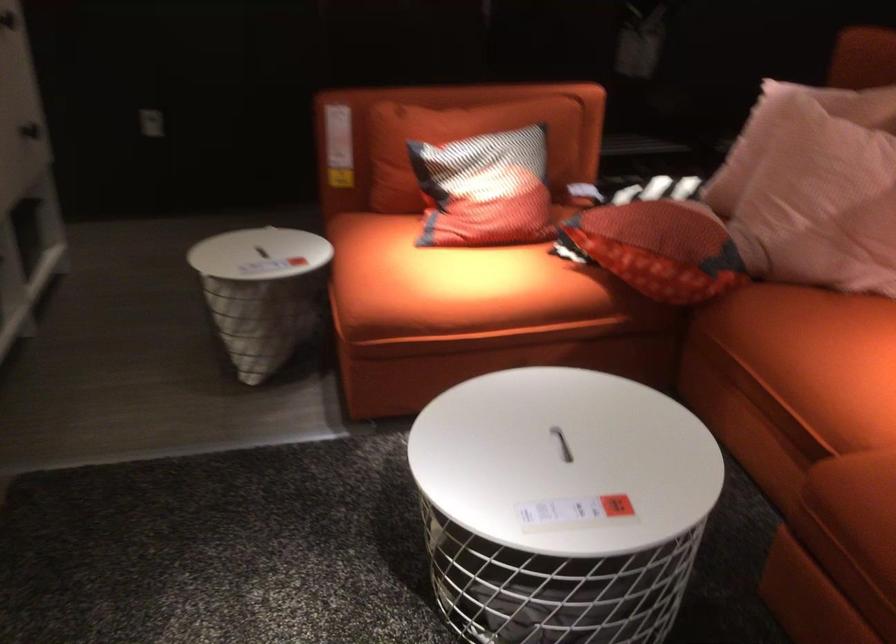
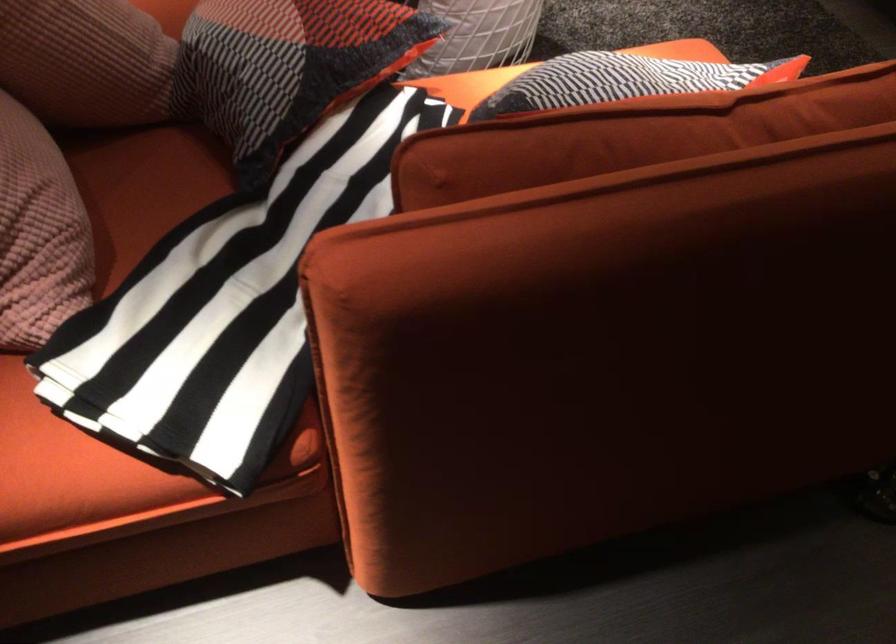
Where in the second image is the point corresponding to (487,131) from the first image?

(623, 80)